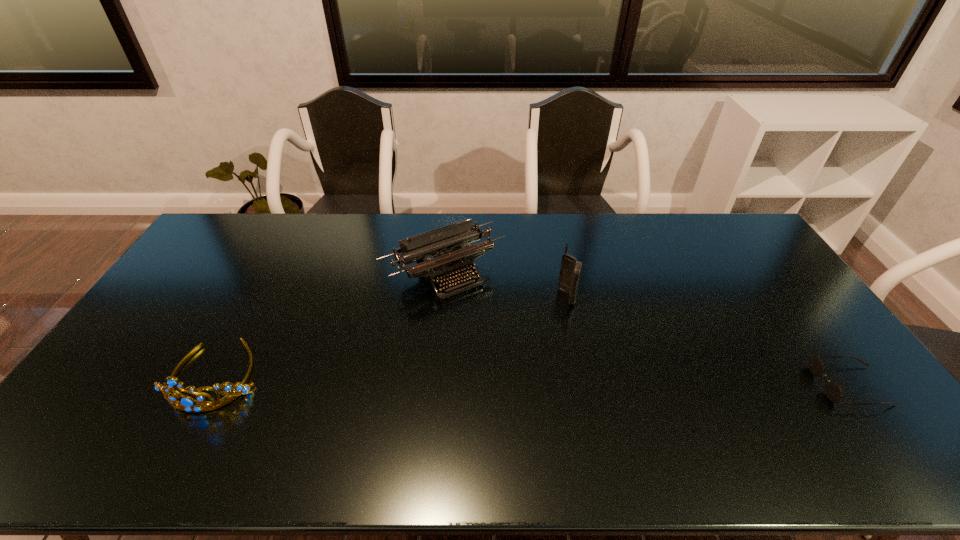
Locate an element on the screen. Image resolution: width=960 pixels, height=540 pixels. free region located 0.400m on the typing side of the third object from right to left is located at coordinates (544, 393).

The height and width of the screenshot is (540, 960). In order to click on vacant region located 0.290m on the typing side of the third object from right to left in this screenshot , I will do `click(521, 363)`.

The image size is (960, 540). Identify the location of vacant space located on the keyboard of the tallest object. (542, 322).

Identify the location of vacant space located 0.290m on the keyboard of the tallest object. (503, 357).

Locate an element on the screen. The image size is (960, 540). free spot located on the keyboard of the tallest object is located at coordinates (493, 365).

This screenshot has width=960, height=540. Find the location of `object that is positioned at the far edge`. object that is positioned at the far edge is located at coordinates (453, 255).

Identify the location of tiara that is at the near edge. Image resolution: width=960 pixels, height=540 pixels. (185, 403).

This screenshot has width=960, height=540. Identify the location of sunglasses at the near edge. tap(834, 392).

The height and width of the screenshot is (540, 960). In order to click on object at the right edge in this screenshot , I will do `click(834, 392)`.

Where is `object situated at the near right corner`? This screenshot has width=960, height=540. object situated at the near right corner is located at coordinates (834, 392).